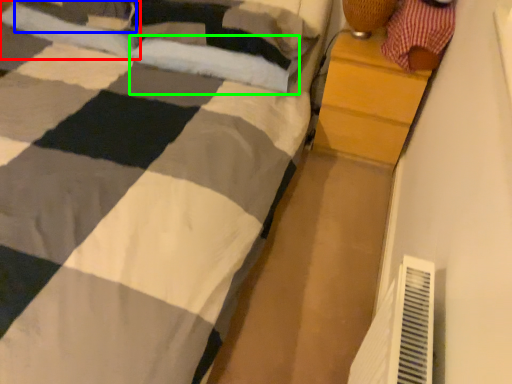
Question: Which object is positioned closest to pillow (highlighted by a red box)? Select from pillow (highlighted by a blue box) and pillow (highlighted by a green box).

Choices:
 (A) pillow
 (B) pillow

Answer: (A)